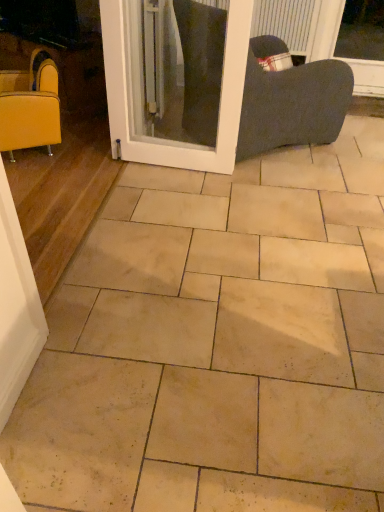
Locate an element on the screen. vacant area located to the right-hand side of white glossy screen door at center is located at coordinates (256, 181).